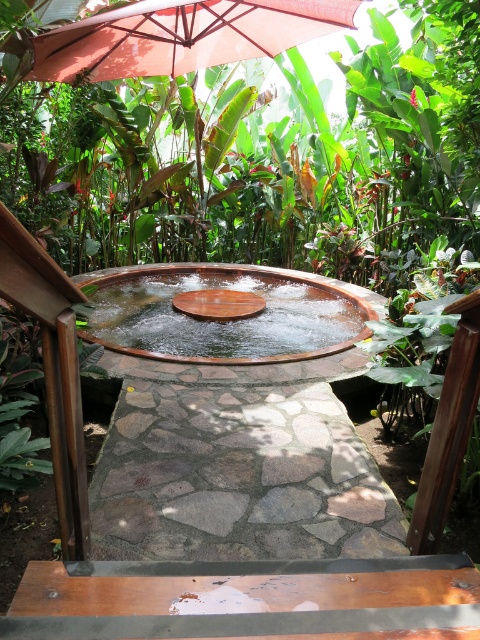
Is brown wooden table at lower center bigger than matte red umbrella at upper center?

No, brown wooden table at lower center is not bigger than matte red umbrella at upper center.

Is brown wooden table at lower center smaller than matte red umbrella at upper center?

Yes.

Describe the element at coordinates (243, 598) in the screenshot. I see `brown wooden table at lower center` at that location.

I want to click on brown wooden table at lower center, so click(x=243, y=598).